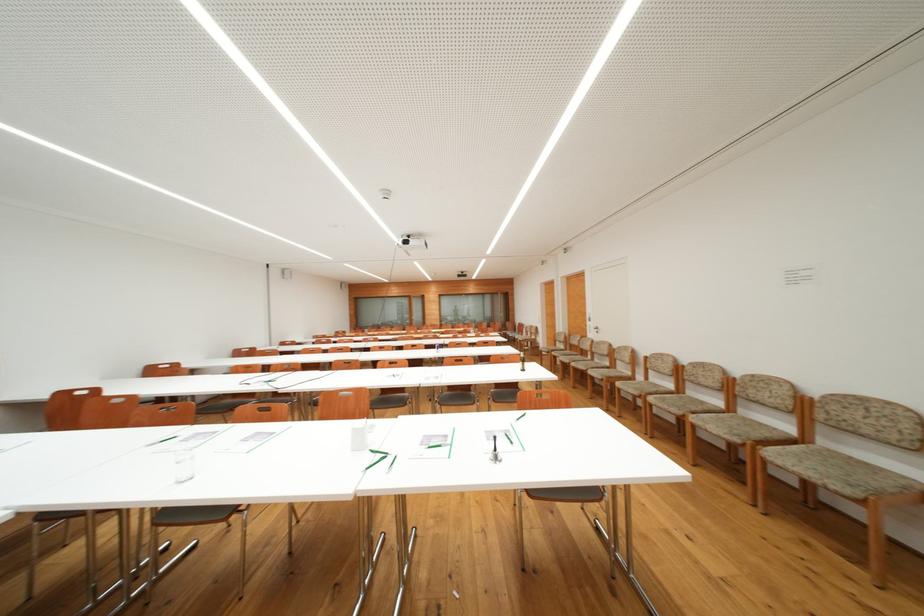
The image size is (924, 616). What do you see at coordinates (850, 463) in the screenshot?
I see `the wooden chair armrest` at bounding box center [850, 463].